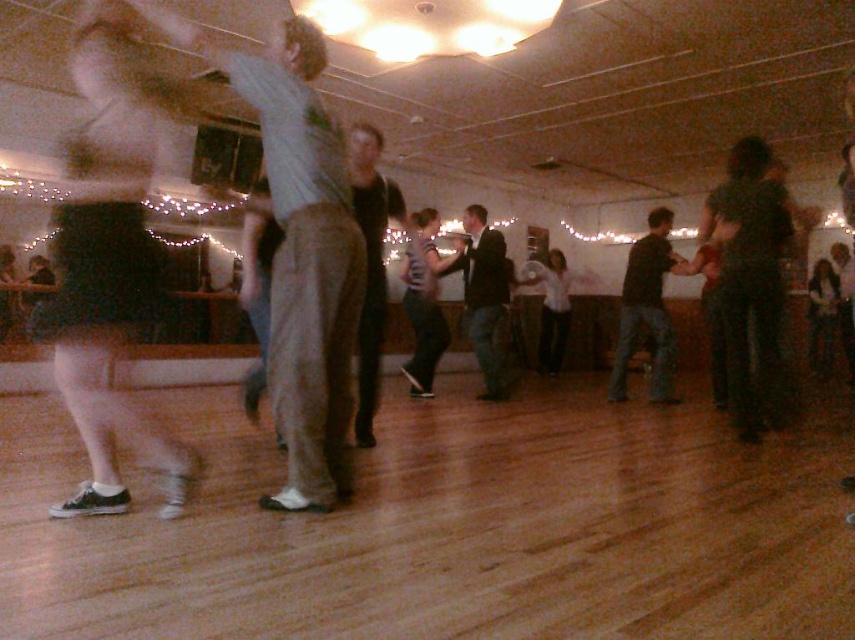
Question: Can you confirm if dark gray pants at center is smaller than smooth black dress at center?

Choices:
 (A) yes
 (B) no

Answer: (B)

Question: Which object is the closest to the light gray cotton pants at center?

Choices:
 (A) white matte shirt at center
 (B) dark blue jeans at center

Answer: (B)

Question: Among these objects, which one is farthest from the camera?

Choices:
 (A) dark blue jeans at center
 (B) dark gray suit at center
 (C) light gray cotton pants at center

Answer: (B)

Question: Which of these objects is positioned closest to the smooth black dress at center?

Choices:
 (A) dark gray pants at center
 (B) white matte shirt at center
 (C) dark gray suit at center

Answer: (B)

Question: In this image, where is dark gray pants at center located relative to smooth black dress at center?

Choices:
 (A) left
 (B) right

Answer: (A)

Question: Can you confirm if light gray cotton pants at center is positioned above dark gray suit at center?

Choices:
 (A) no
 (B) yes

Answer: (B)